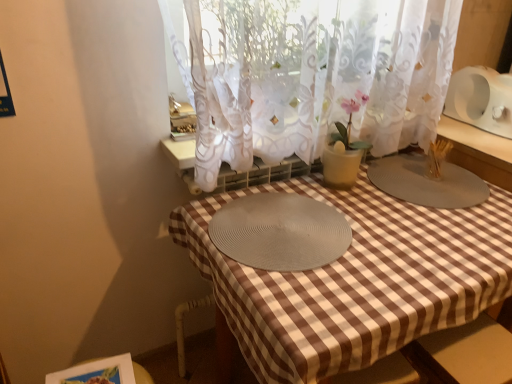
Question: Is gray woven placemat at center, placed as the second glass plate when sorted from right to left, bigger or smaller than white sheer curtain at center?

Choices:
 (A) big
 (B) small

Answer: (B)

Question: From the image's perspective, relative to white sheer curtain at center, is gray woven placemat at center, positioned as the 1th glass plate in left-to-right order, above or below?

Choices:
 (A) below
 (B) above

Answer: (A)

Question: Which object is positioned farthest from the gray woven placemat at center, placed as the second glass plate when sorted from right to left?

Choices:
 (A) white sheer curtain at center
 (B) gray matte placemat at center, the first glass plate positioned from the right

Answer: (B)

Question: Estimate the real-world distances between objects in this image. Which object is farther from the gray matte placemat at center, which ranks as the second glass plate in left-to-right order?

Choices:
 (A) white sheer curtain at center
 (B) gray woven placemat at center, positioned as the 1th glass plate in left-to-right order

Answer: (B)